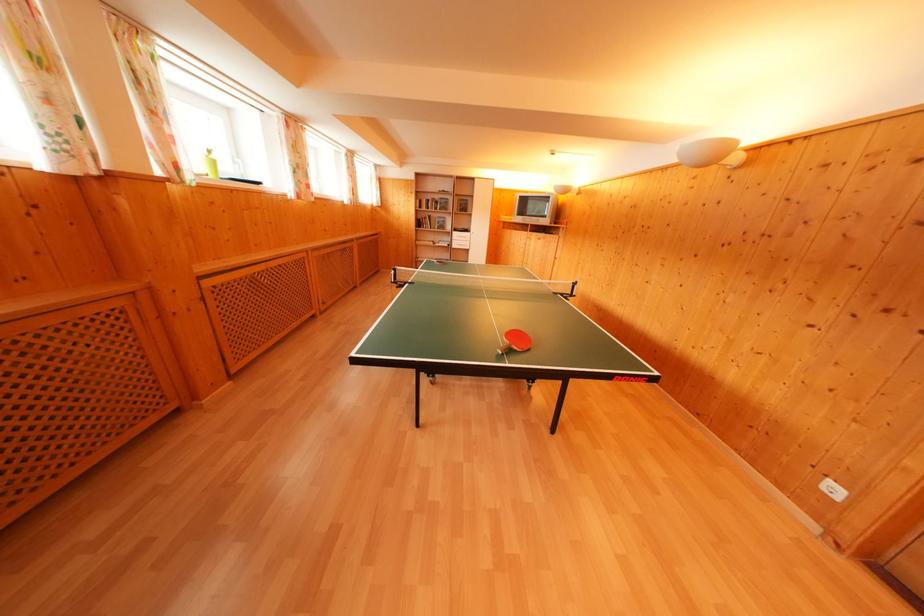
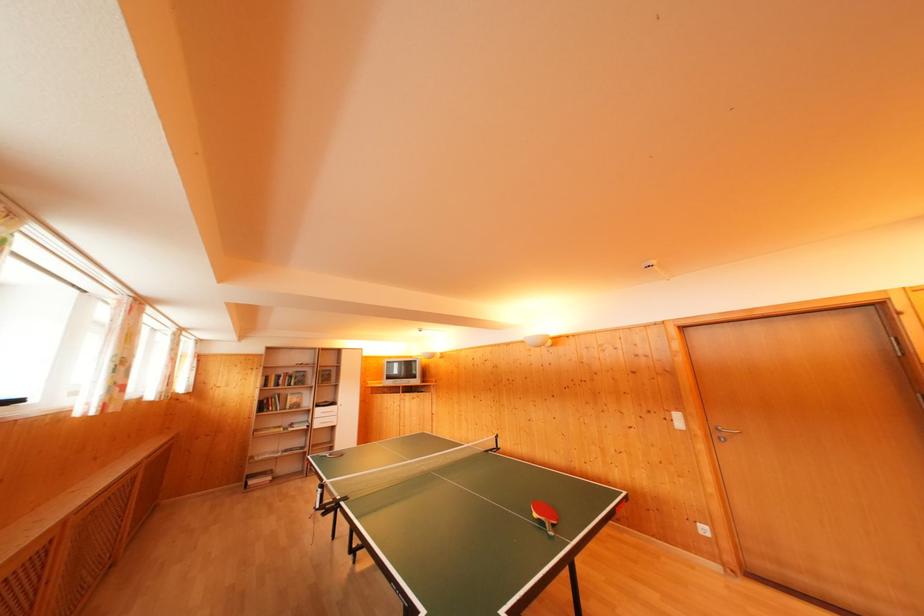
In the second image, find the point that corresponds to (x=424, y=228) in the first image.

(268, 411)